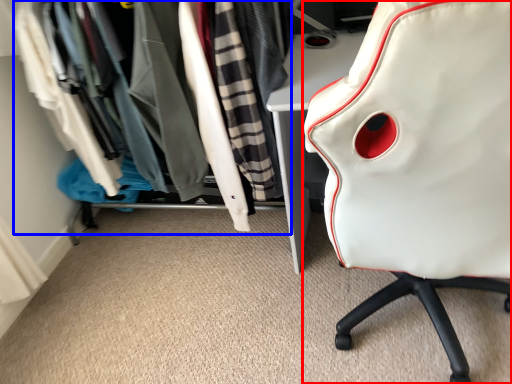
Question: Which point is further to the camera, chair (highlighted by a red box) or closet (highlighted by a blue box)?

Choices:
 (A) chair
 (B) closet

Answer: (B)